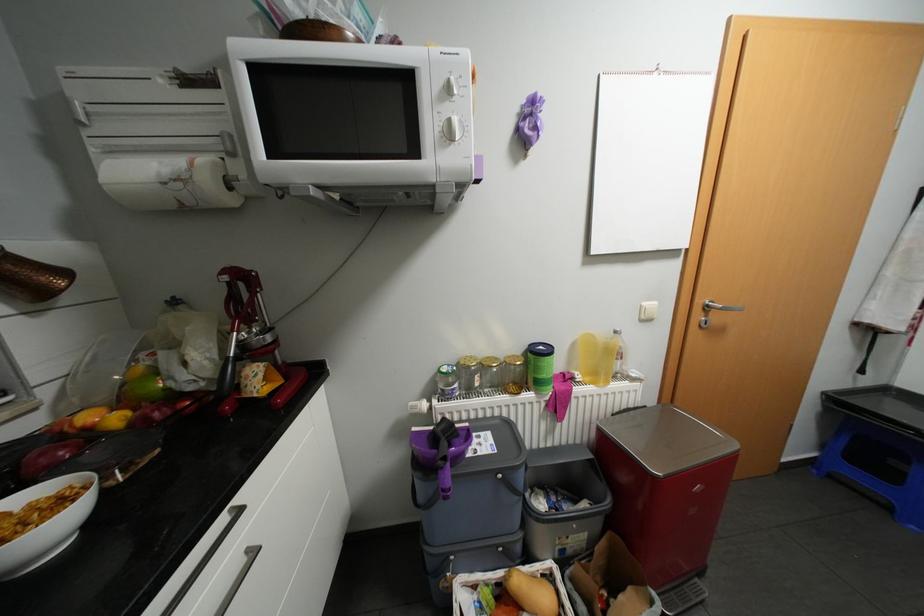
You are a GUI agent. You are given a task and a screenshot of the screen. Output one action in this format:
    pyautogui.click(x=<x>, y=<y>)
    Task: Click on the yellow plastic pitcher
    The height and width of the screenshot is (616, 924).
    Given the screenshot: What is the action you would take?
    pyautogui.click(x=597, y=358)